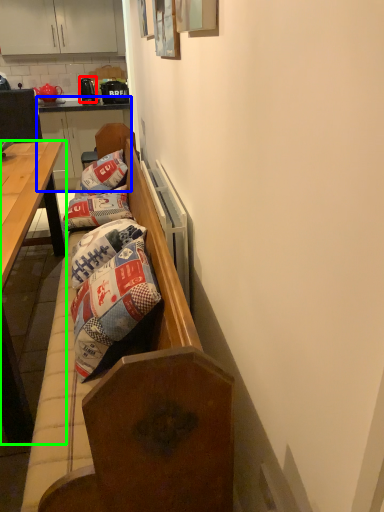
Question: Considering the real-world distances, which object is closest to kitchen appliance (highlighted by a red box)? dresser (highlighted by a blue box) or desk (highlighted by a green box).

Choices:
 (A) dresser
 (B) desk

Answer: (A)